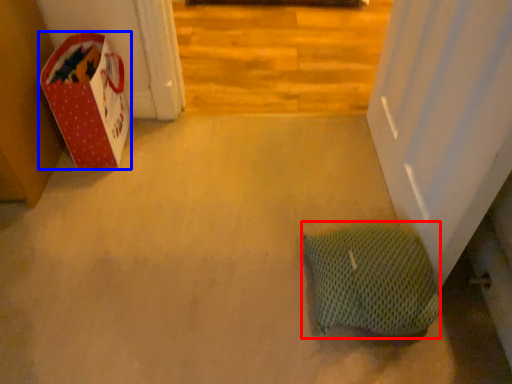
Question: Which point is closer to the camera, pillow (highlighted by a red box) or cardboard box (highlighted by a blue box)?

Choices:
 (A) pillow
 (B) cardboard box

Answer: (A)